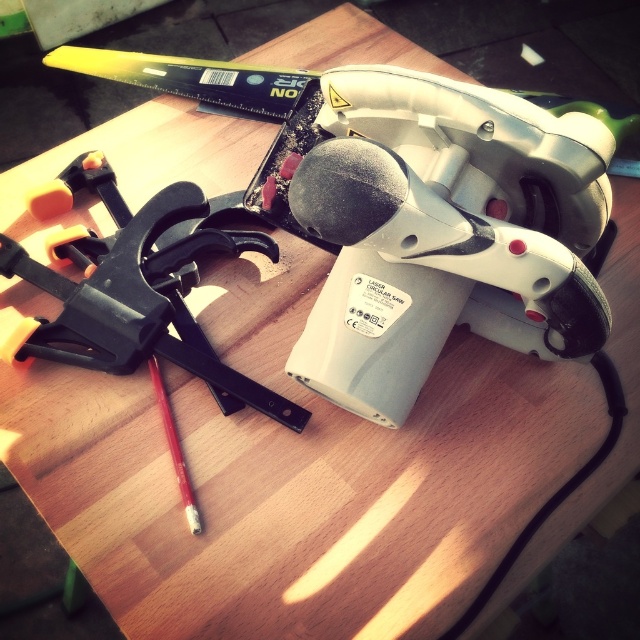
Is black plastic clamp at upper left positioned at the back of red wood pencil at center?

Yes, it is.

Is point (106, 360) more distant than point (189, 529)?

Yes, point (106, 360) is behind point (189, 529).

This screenshot has width=640, height=640. I want to click on black plastic clamp at upper left, so click(x=138, y=289).